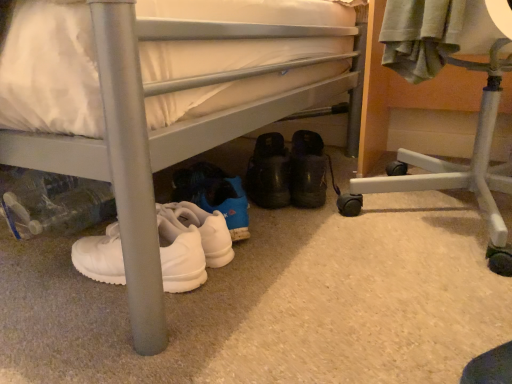
Question: From the image's perspective, is white matte sneakers at lower left on white plastic chair at lower right?

Choices:
 (A) yes
 (B) no

Answer: (A)

Question: Is white matte sneakers at lower left facing towards white plastic chair at lower right?

Choices:
 (A) yes
 (B) no

Answer: (A)

Question: From a real-world perspective, is white matte sneakers at lower left located beneath white plastic chair at lower right?

Choices:
 (A) no
 (B) yes

Answer: (A)

Question: Does white matte sneakers at lower left appear on the right side of white plastic chair at lower right?

Choices:
 (A) yes
 (B) no

Answer: (B)

Question: Is white matte sneakers at lower left further to the viewer compared to white plastic chair at lower right?

Choices:
 (A) no
 (B) yes

Answer: (A)

Question: Considering the positions of white plastic chair at lower right and white matte sneakers at lower left in the image, is white plastic chair at lower right bigger or smaller than white matte sneakers at lower left?

Choices:
 (A) big
 (B) small

Answer: (B)

Question: In terms of height, does white plastic chair at lower right look taller or shorter compared to white matte sneakers at lower left?

Choices:
 (A) short
 (B) tall

Answer: (A)

Question: Considering the positions of white plastic chair at lower right and white matte sneakers at lower left in the image, is white plastic chair at lower right wider or thinner than white matte sneakers at lower left?

Choices:
 (A) wide
 (B) thin

Answer: (B)

Question: Is white plastic chair at lower right to the left or to the right of white matte sneakers at lower left in the image?

Choices:
 (A) right
 (B) left

Answer: (A)

Question: Is white matte sneakers at lower left wider or thinner than black suede shoes at center?

Choices:
 (A) wide
 (B) thin

Answer: (A)

Question: Based on their sizes in the image, would you say white matte sneakers at lower left is bigger or smaller than black suede shoes at center?

Choices:
 (A) big
 (B) small

Answer: (A)

Question: Is white matte sneakers at lower left to the left or to the right of black suede shoes at center in the image?

Choices:
 (A) left
 (B) right

Answer: (A)

Question: From a real-world perspective, is white matte sneakers at lower left physically located above or below black suede shoes at center?

Choices:
 (A) above
 (B) below

Answer: (A)

Question: Is white matte sneakers at lower left taller or shorter than white plastic chair at lower right?

Choices:
 (A) short
 (B) tall

Answer: (B)

Question: Is point (170, 147) positioned closer to the camera than point (507, 49)?

Choices:
 (A) farther
 (B) closer

Answer: (B)